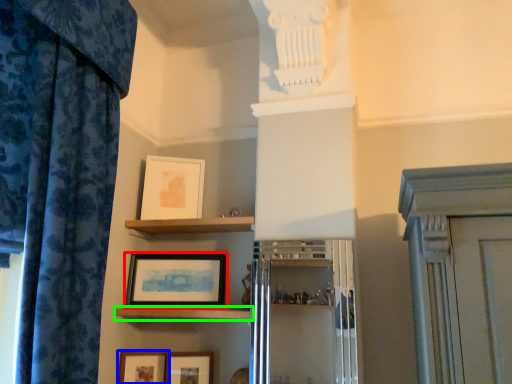
Question: Which is nearer to the picture frame (highlighted by a red box)? picture frame (highlighted by a blue box) or shelf (highlighted by a green box).

Choices:
 (A) picture frame
 (B) shelf

Answer: (B)